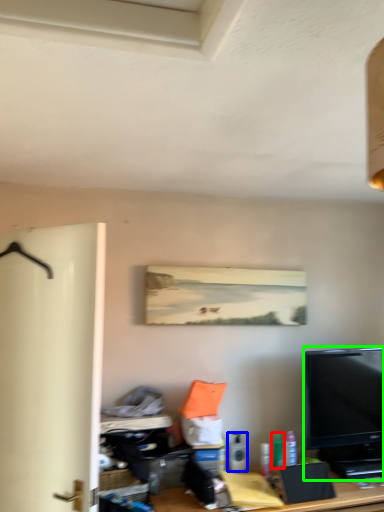
Question: Which is farther away from toiletry (highlighted by a red box)? toiletry (highlighted by a blue box) or television (highlighted by a green box)?

Choices:
 (A) toiletry
 (B) television

Answer: (B)